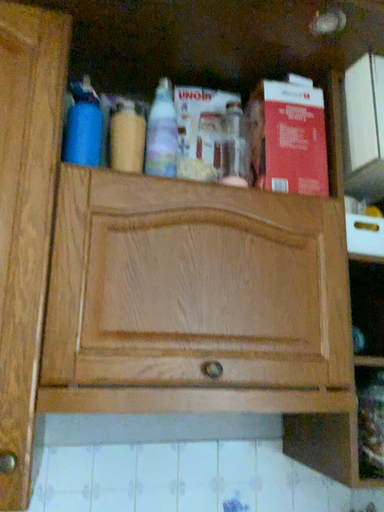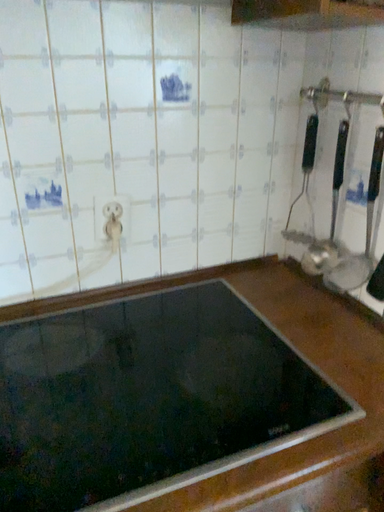
Question: How did the camera likely rotate when shooting the video?

Choices:
 (A) rotated upward
 (B) rotated downward

Answer: (B)